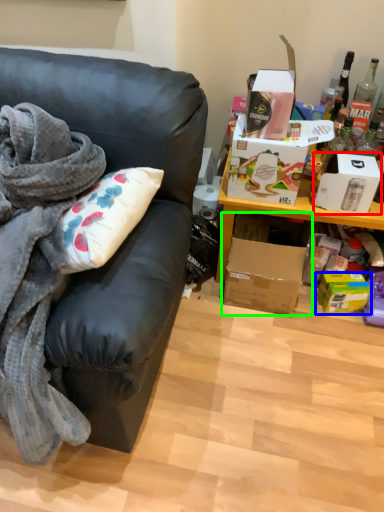
Question: Estimate the real-world distances between objects in this image. Which object is closer to box (highlighted by a red box), box (highlighted by a blue box) or box (highlighted by a green box)?

Choices:
 (A) box
 (B) box

Answer: (B)